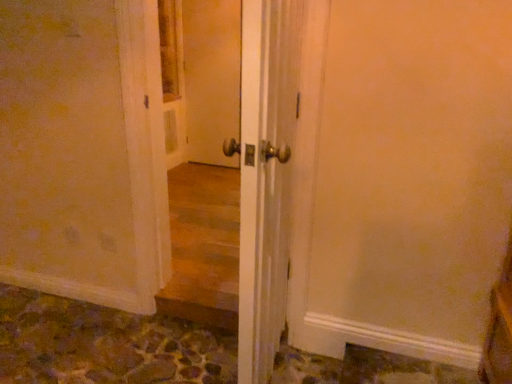
What do you see at coordinates (265, 176) in the screenshot? This screenshot has width=512, height=384. I see `white wood door at center` at bounding box center [265, 176].

The image size is (512, 384). What are the coordinates of `white wood door at center` in the screenshot? It's located at (265, 176).

The width and height of the screenshot is (512, 384). What are the coordinates of `white wood door at center` in the screenshot? It's located at (265, 176).